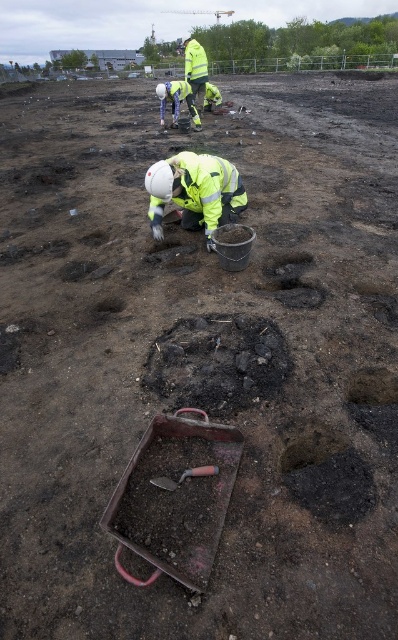
Question: Considering the real-world distances, which object is farthest from the metallic shovel at center?

Choices:
 (A) reflective yellow safety vest at upper center
 (B) high visibility yellow jacket at center

Answer: (A)

Question: Is high visibility yellow jacket at center thinner than metallic shovel at center?

Choices:
 (A) yes
 (B) no

Answer: (B)

Question: Is high visibility yellow jacket at center bigger than metallic shovel at center?

Choices:
 (A) no
 (B) yes

Answer: (B)

Question: Estimate the real-world distances between objects in this image. Which object is closer to the high visibility yellow jacket at center?

Choices:
 (A) reflective yellow safety vest at upper center
 (B) metallic shovel at center

Answer: (B)

Question: Which object is the farthest from the metallic shovel at center?

Choices:
 (A) high visibility yellow jacket at center
 (B) reflective yellow safety vest at upper center

Answer: (B)

Question: Is high visibility yellow jacket at center bigger than metallic shovel at center?

Choices:
 (A) yes
 (B) no

Answer: (A)